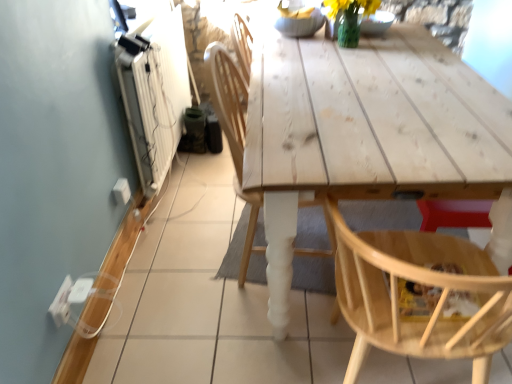
What are the coordinates of `free point in front of wooden chair at center, acting as the 1th chair starting from the left` in the screenshot? It's located at (254, 331).